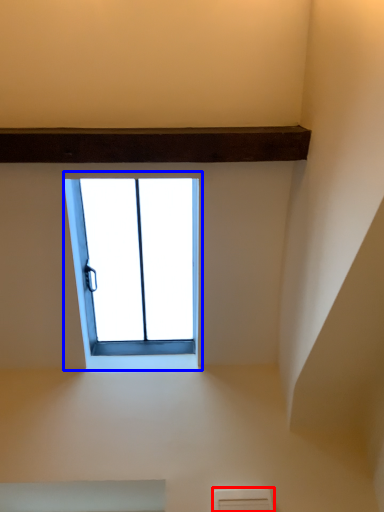
Question: Among these objects, which one is farthest to the camera, air conditioning (highlighted by a red box) or window (highlighted by a blue box)?

Choices:
 (A) air conditioning
 (B) window

Answer: (A)